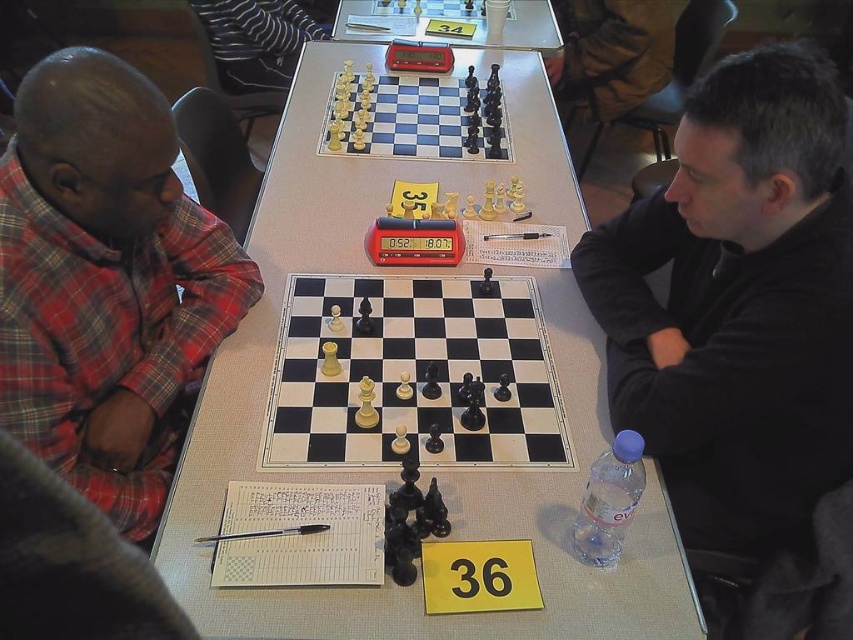
Consider the image. You are a photographer taking a picture of the chess match. You notice a point at coordinates (737, 304). What object is located at that point?

The point at coordinates (737, 304) indicates the black matte shirt at center.

You are a photographer trying to capture a closeup of both the black matte shirt at center and the plaid fabric shirt at left. Since you can only focus on one subject at a time, which shirt should you choose to ensure the other is still somewhat in focus?

The black matte shirt at center is larger in size than plaid fabric shirt at left. To ensure both are somewhat in focus, you should focus on the black matte shirt at center because it is larger and might require more precise focus, while the smaller plaid fabric shirt at left may still remain partially in focus due to its smaller size.

You are a chess player who just arrived at the tournament. You notice the white glossy chessboard at center and the wooden chess set at center. Which object is located to the right of the other?

The white glossy chessboard at center is positioned on the right side of wooden chess set at center, so the chessboard is to the right of the chess set.